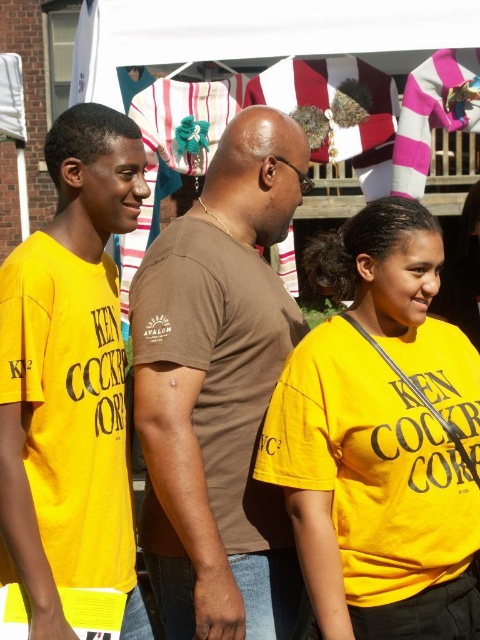
Question: Which object appears farthest from the camera in this image?

Choices:
 (A) brown cotton t-shirt at center
 (B) yellow matte shirt at center

Answer: (A)

Question: Among these objects, which one is nearest to the camera?

Choices:
 (A) yellow matte shirt at center
 (B) brown cotton t-shirt at center

Answer: (A)

Question: Is yellow matte shirt at center smaller than yellow cotton t-shirt at left?

Choices:
 (A) yes
 (B) no

Answer: (B)

Question: Can you confirm if brown cotton t-shirt at center is thinner than yellow cotton t-shirt at left?

Choices:
 (A) yes
 (B) no

Answer: (B)

Question: Which of the following is the farthest from the observer?

Choices:
 (A) brown cotton t-shirt at center
 (B) yellow matte shirt at center
 (C) yellow cotton t-shirt at left

Answer: (A)

Question: Is yellow matte shirt at center to the left of yellow cotton t-shirt at left from the viewer's perspective?

Choices:
 (A) yes
 (B) no

Answer: (B)